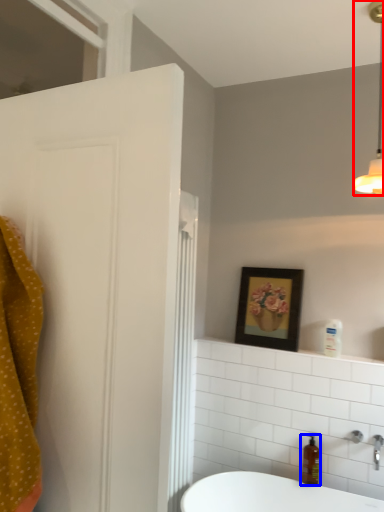
Question: Which point is closer to the camera, light fixture (highlighted by a red box) or soap dispenser (highlighted by a blue box)?

Choices:
 (A) light fixture
 (B) soap dispenser

Answer: (A)